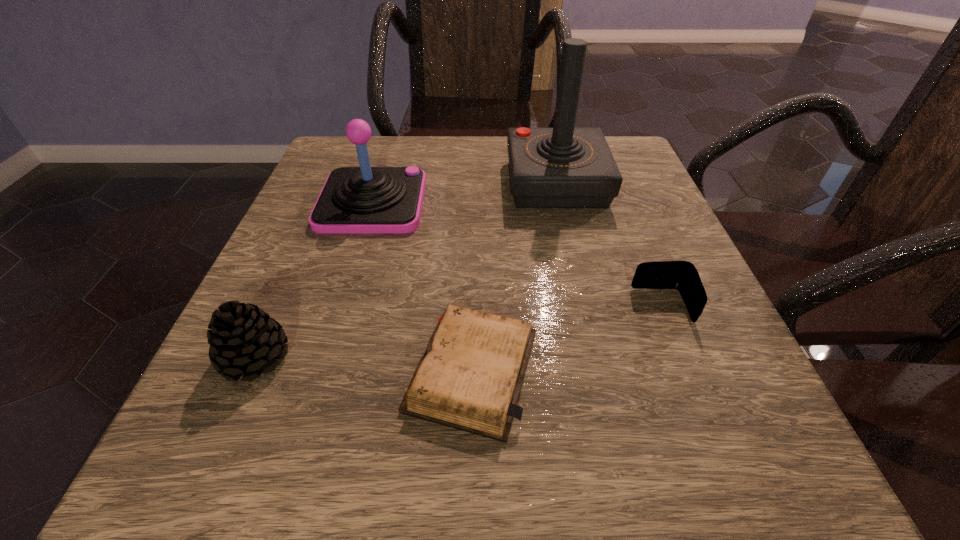
Locate an element on the screen. vacant space that satisfies the following two spatial constraints: 1. on the outer surface of the wallet; 2. on the front side of the diary is located at coordinates (688, 370).

Find the location of a particular element. free space that satisfies the following two spatial constraints: 1. on the back side of the diary; 2. forward from the base of the left joystick is located at coordinates (475, 202).

The height and width of the screenshot is (540, 960). What are the coordinates of `free point that satisfies the following two spatial constraints: 1. at the narrow end of the third shortest object; 2. on the left side of the diary` in the screenshot? It's located at (250, 370).